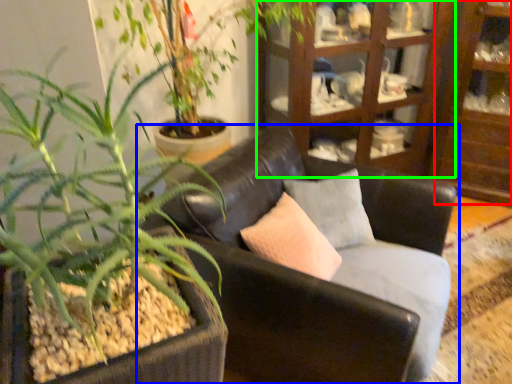
Question: Which object is the closest to the shelf (highlighted by a red box)? Choose among these: chair (highlighted by a blue box) or cabinetry (highlighted by a green box).

Choices:
 (A) chair
 (B) cabinetry

Answer: (B)